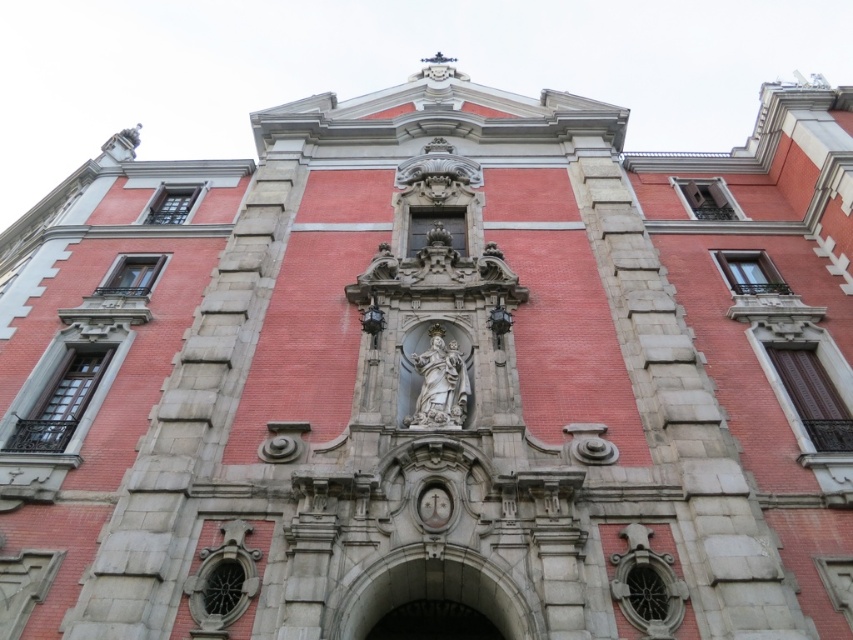
Question: In this image, where is white stone arch at center located relative to white marble statue at center?

Choices:
 (A) below
 (B) above

Answer: (A)

Question: Does white stone arch at center have a smaller size compared to white marble statue at center?

Choices:
 (A) yes
 (B) no

Answer: (B)

Question: Which of the following is the farthest from the observer?

Choices:
 (A) white stone arch at center
 (B) white marble statue at center

Answer: (B)

Question: Which of the following is the closest to the observer?

Choices:
 (A) white marble statue at center
 (B) white stone arch at center

Answer: (B)

Question: Is the position of white stone arch at center less distant than that of white marble statue at center?

Choices:
 (A) yes
 (B) no

Answer: (A)